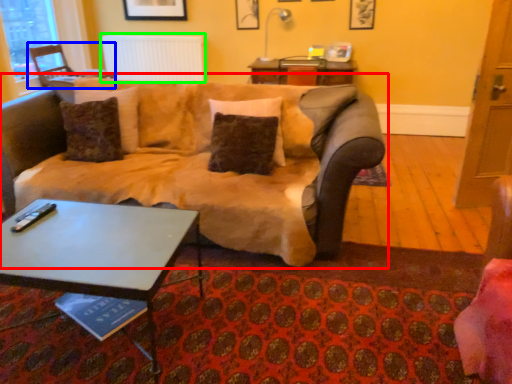
Question: Considering the real-world distances, which object is closest to studio couch (highlighted by a red box)? chair (highlighted by a blue box) or radiator (highlighted by a green box).

Choices:
 (A) chair
 (B) radiator

Answer: (A)